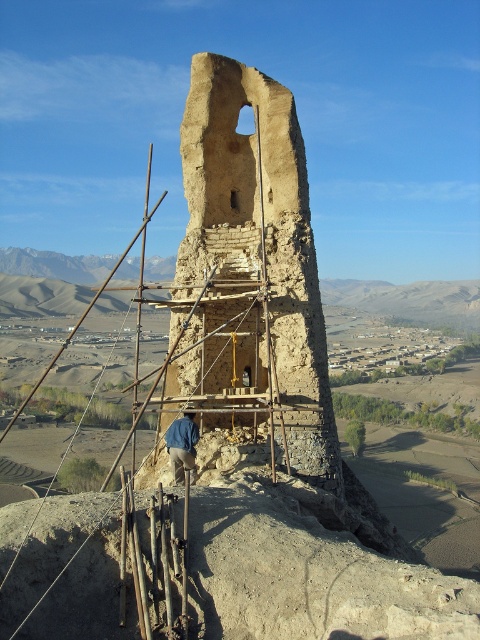
Can you confirm if earthy brown stone tower at center is positioned to the right of blue denim jacket at center?

Yes, earthy brown stone tower at center is to the right of blue denim jacket at center.

This screenshot has width=480, height=640. Describe the element at coordinates (250, 275) in the screenshot. I see `earthy brown stone tower at center` at that location.

The image size is (480, 640). What do you see at coordinates (250, 275) in the screenshot? I see `earthy brown stone tower at center` at bounding box center [250, 275].

Image resolution: width=480 pixels, height=640 pixels. Find the location of `earthy brown stone tower at center`. earthy brown stone tower at center is located at coordinates (250, 275).